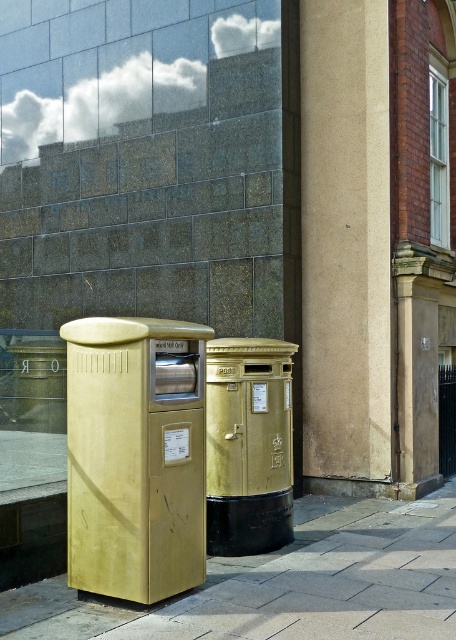
Is point (83, 563) more distant than point (207, 408)?

No, (83, 563) is closer to viewer.

Who is higher up, matte gold mailbox at left or gold matte postbox at center?

matte gold mailbox at left

Image resolution: width=456 pixels, height=640 pixels. I want to click on matte gold mailbox at left, so click(x=135, y=456).

You are a GUI agent. You are given a task and a screenshot of the screen. Output one action in this format:
    pyautogui.click(x=<x>, y=<y>)
    Task: Click on the matte gold mailbox at left
    The image size is (456, 640).
    Given the screenshot: What is the action you would take?
    pyautogui.click(x=135, y=456)

Is smooth beige pillar at center thinner than smooth concrete pavement at lower center?

Indeed, smooth beige pillar at center has a lesser width compared to smooth concrete pavement at lower center.

Between smooth beige pillar at center and smooth concrete pavement at lower center, which one has more height?

Standing taller between the two is smooth beige pillar at center.

This screenshot has height=640, width=456. What are the coordinates of `smooth beige pillar at center` in the screenshot? It's located at click(x=345, y=241).

This screenshot has width=456, height=640. Find the location of `smooth beige pillar at center`. smooth beige pillar at center is located at coordinates (345, 241).

From the picture: Can you confirm if smooth concrete pavement at lower center is positioned above gold matte postbox at center?

No.

Does point (362, 529) lie behind point (260, 467)?

Yes, point (362, 529) is behind point (260, 467).

Which is in front, point (294, 554) or point (263, 426)?

Point (263, 426) is in front.

The image size is (456, 640). In order to click on smooth concrete pavement at lower center in this screenshot , I will do `click(288, 582)`.